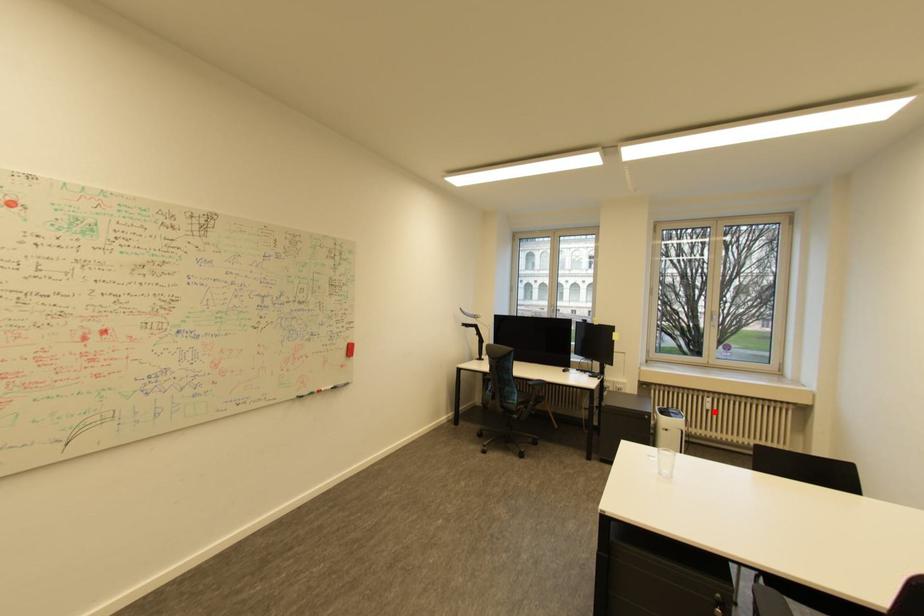
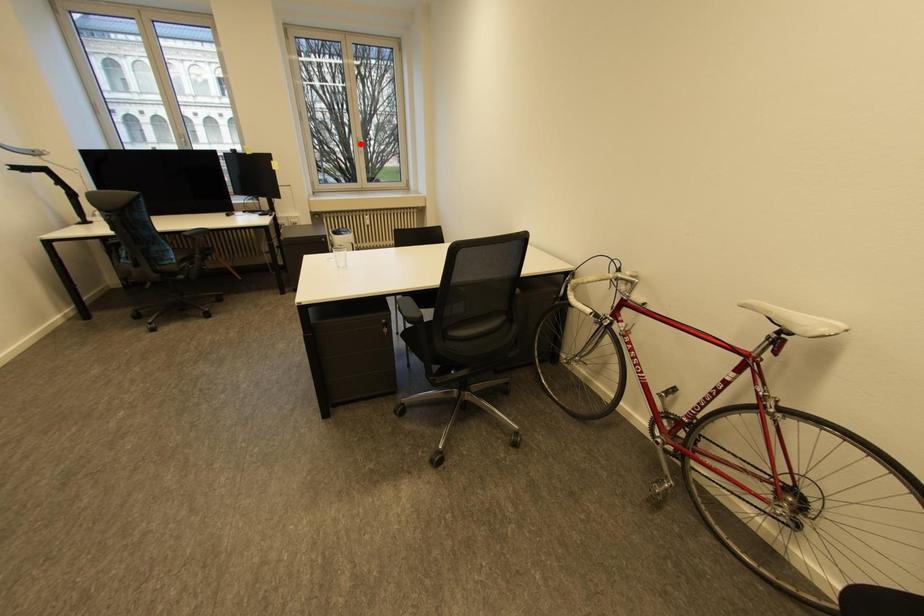
I am providing you with two images of the same scene from different viewpoints. A red point is marked on the first image and another point is marked on the second image. Is the red point in image1 aligned with the point shown in image2?

No